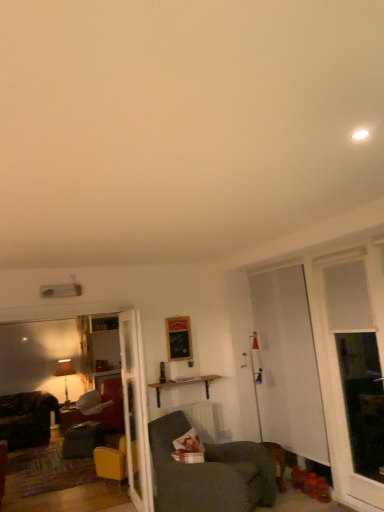
Question: From the image's perspective, is white glossy door at center above or below white textured window at right?

Choices:
 (A) above
 (B) below

Answer: (B)

Question: Is white glossy door at center inside the boundaries of white textured window at right, or outside?

Choices:
 (A) outside
 (B) inside

Answer: (A)

Question: Based on their relative distances, which object is farther from the white textured window at right?

Choices:
 (A) wooden shelf at center
 (B) brushed wood desk at lower left
 (C) matte black lamp at left
 (D) velvet dark grey swivel chair at lower left
 (E) white translucent screen door at right

Answer: (B)

Question: Estimate the real-world distances between objects in this image. Which object is closer to the matte gray fabric couch at center-left?

Choices:
 (A) velvet dark grey swivel chair at lower left
 (B) white glossy door at center
 (C) wooden shelf at center
 (D) dark gray fabric chair at left, which appears as the 1th chair when ordered from the bottom
 (E) dark gray fabric chair at lower center, the first chair viewed from the right

Answer: (A)